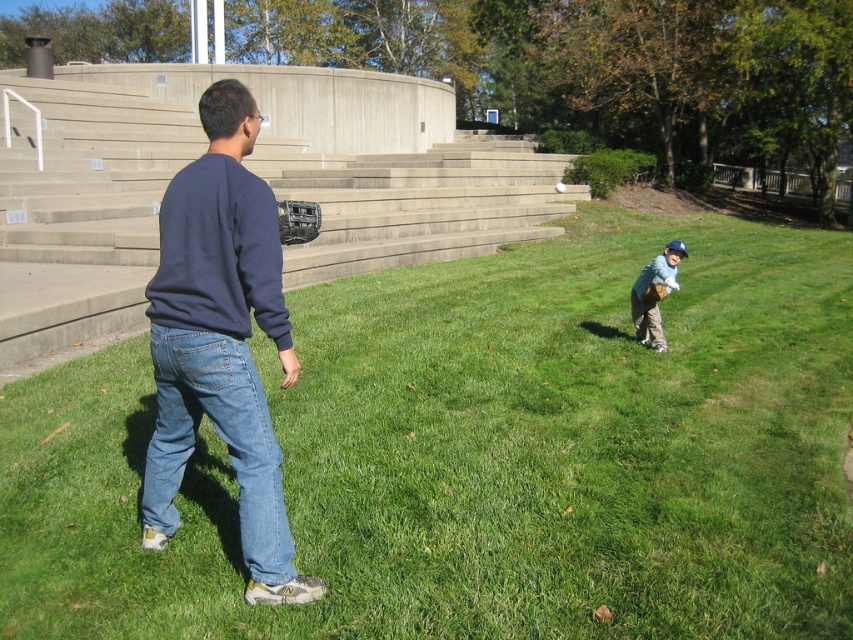
You are standing in the park and see the green grass at center and the dark blue sweatshirt at center. Which one takes up more space in the image?

The green grass at center takes up more space in the image because it is bigger than the dark blue sweatshirt at center.

You are a photographer trying to capture a clear shot of the light blue jersey at lower right without the green grass at center blocking the view. Based on their positions, is this possible?

The green grass at center is much taller than the light blue jersey at lower right, so it might block the view. To capture a clear shot of the light blue jersey at lower right, you might need to adjust your angle or position to avoid the taller grass.